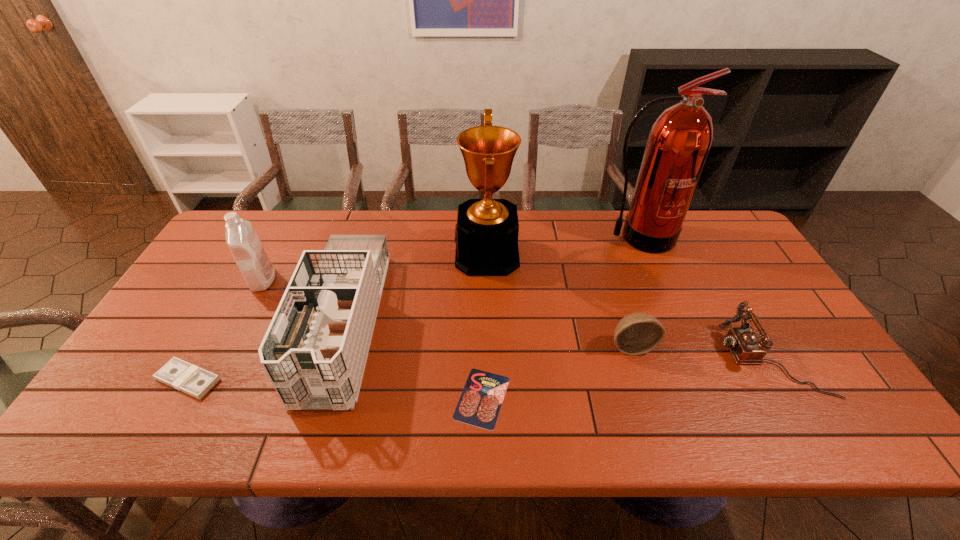
Locate an element on the screen. This screenshot has width=960, height=540. fire extinguisher is located at coordinates (680, 140).

Locate an element on the screen. trophy cup is located at coordinates (486, 235).

Image resolution: width=960 pixels, height=540 pixels. I want to click on detergent, so click(x=246, y=248).

Find the location of a particular element. The image size is (960, 540). the fifth shortest object is located at coordinates (314, 352).

Locate an element on the screen. the third object from left to right is located at coordinates (314, 352).

Locate an element on the screen. This screenshot has width=960, height=540. bowl is located at coordinates (638, 333).

Locate an element on the screen. telephone is located at coordinates (744, 344).

Find the location of `the second shortest object`. the second shortest object is located at coordinates (181, 375).

Find the location of a particular element. The height and width of the screenshot is (540, 960). salami is located at coordinates (479, 405).

At what (x,y) coordinates should I click in order to perform the action: click on vacant space situated on the front-facing side of the tallest object. Please return your answer as a coordinate pair (x, y). The width and height of the screenshot is (960, 540). Looking at the image, I should click on (654, 273).